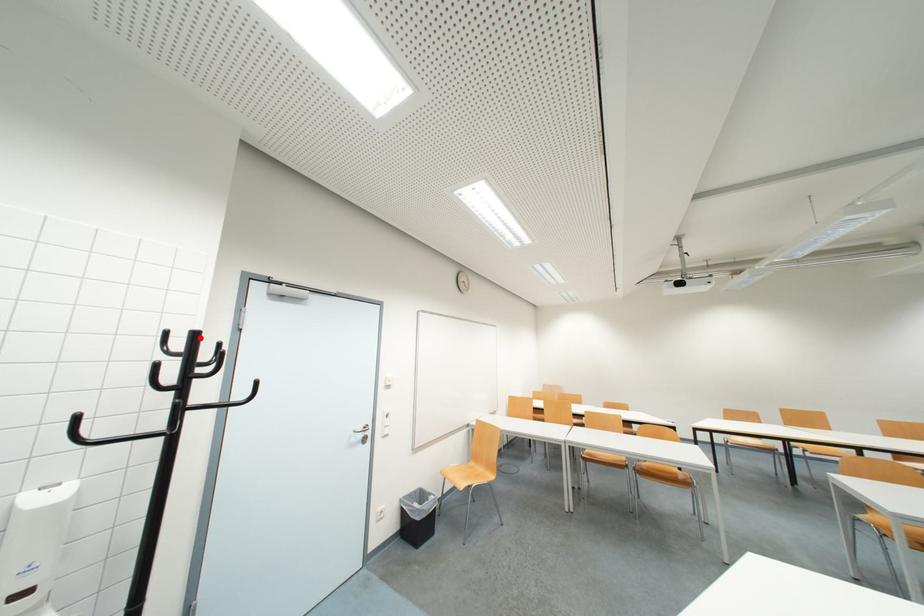
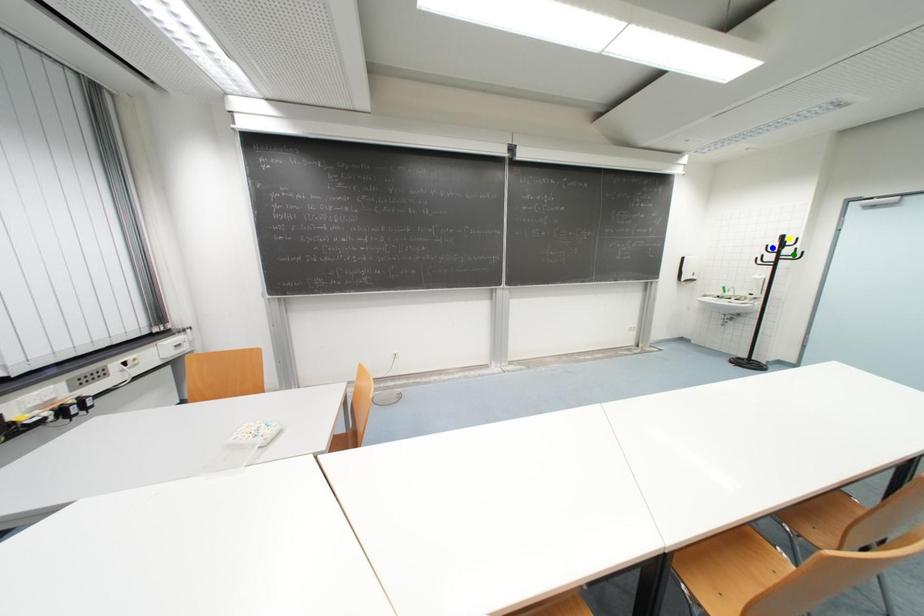
Question: I am providing you with two images of the same scene from different viewpoints. A red point is marked on the first image. You are given multiple points on the second image. Which point in image 2 is actually the same real-world point as the red point in image 1?

Choices:
 (A) blue point
 (B) yellow point
 (C) green point

Answer: (B)